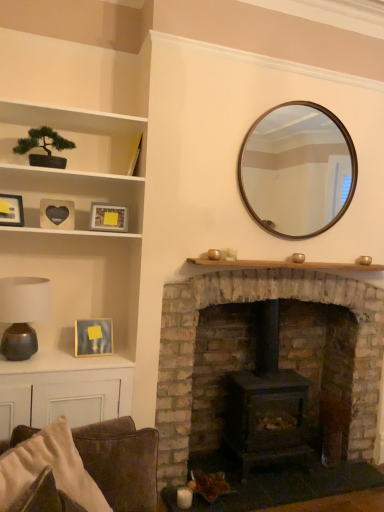
Question: Is wooden at center, the 2th shelf from the top, taller or shorter than wooden picture frame at upper left, which is counted as the second picture frame, starting from the top?

Choices:
 (A) short
 (B) tall

Answer: (A)

Question: Is wooden at center, which ranks as the second shelf in left-to-right order, bigger or smaller than wooden picture frame at upper left, which ranks as the first picture frame in left-to-right order?

Choices:
 (A) small
 (B) big

Answer: (B)

Question: Estimate the real-world distances between objects in this image. Which object is closer to the wooden picture frame at upper left, marked as the 4th picture frame in a right-to-left arrangement?

Choices:
 (A) metallic silver picture frame at upper left, the second picture frame when ordered from bottom to top
 (B) matte brown lamp at left
 (C) white cotton pillow at lower left
 (D) black matte heart at upper left, the fourth picture frame when ordered from bottom to top
 (E) green matte bonsai tree at upper left, which ranks as the 1th shelf in top-to-bottom order

Answer: (D)

Question: Considering the real-world distances, which object is closest to the green matte bonsai tree at upper left, which ranks as the 1th shelf in top-to-bottom order?

Choices:
 (A) matte brown lamp at left
 (B) dark gray matte wood burning stove at center
 (C) matte brown table at lower left
 (D) wooden picture frame at upper left, which is counted as the second picture frame, starting from the top
 (E) wooden picture frame at left, positioned as the third picture frame in left-to-right order

Answer: (D)